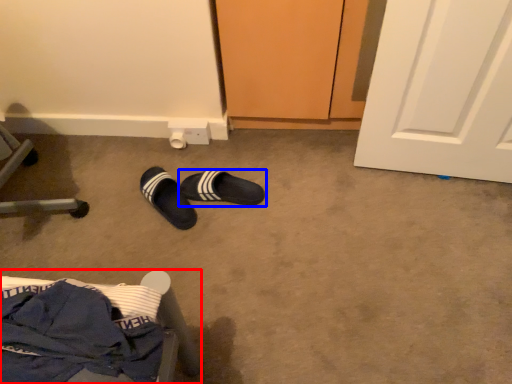
Question: Among these objects, which one is nearest to the camera, furniture (highlighted by a red box) or footwear (highlighted by a blue box)?

Choices:
 (A) furniture
 (B) footwear

Answer: (A)